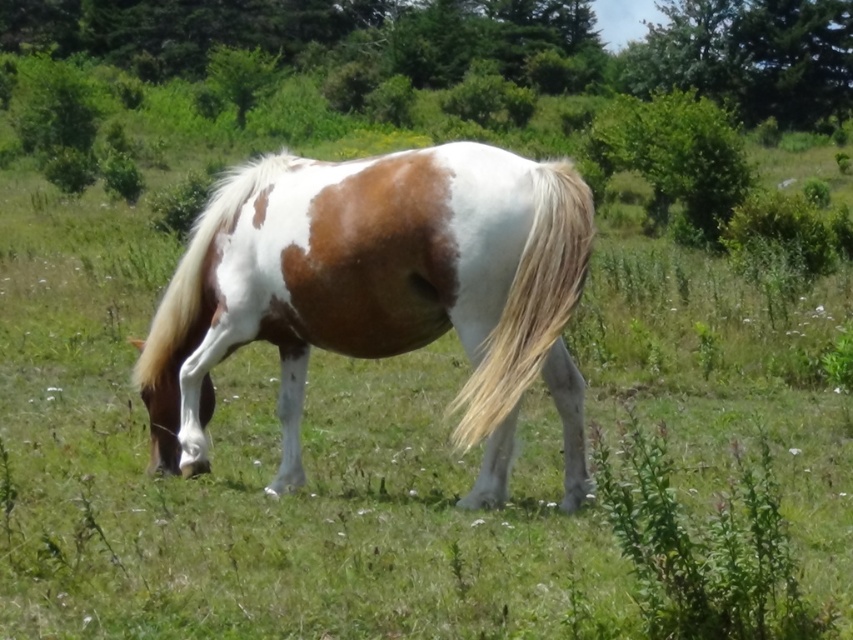
Measure the distance between white and brown speckled horse at center and camera.

3.16 meters

Is point (158, 394) less distant than point (233, 220)?

That is False.

This screenshot has width=853, height=640. What are the coordinates of `white and brown speckled horse at center` in the screenshot? It's located at (379, 292).

Is white and brown speckled horse at center further to the viewer compared to blonde silky tail at center?

Yes, it is behind blonde silky tail at center.

Is point (372, 198) closer to camera compared to point (508, 410)?

No, it is behind (508, 410).

Image resolution: width=853 pixels, height=640 pixels. Find the location of `white and brown speckled horse at center`. white and brown speckled horse at center is located at coordinates (379, 292).

How much distance is there between blonde silky tail at center and white silky mane at center?

blonde silky tail at center is 10.72 feet from white silky mane at center.

Does blonde silky tail at center have a smaller size compared to white silky mane at center?

Yes, blonde silky tail at center is smaller than white silky mane at center.

Describe the element at coordinates (531, 301) in the screenshot. Image resolution: width=853 pixels, height=640 pixels. I see `blonde silky tail at center` at that location.

I want to click on blonde silky tail at center, so click(531, 301).